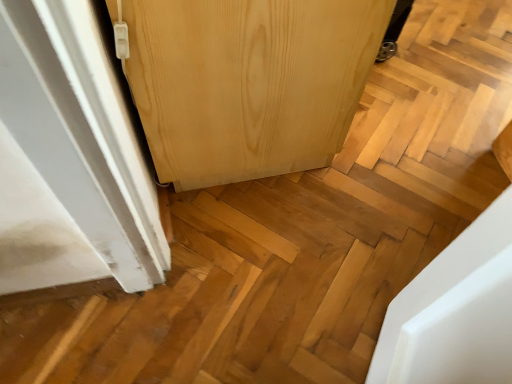
The image size is (512, 384). What are the coordinates of `natural wood door at center` in the screenshot? It's located at (248, 82).

The height and width of the screenshot is (384, 512). Describe the element at coordinates (248, 82) in the screenshot. I see `natural wood door at center` at that location.

Where is `natural wood door at center`? This screenshot has width=512, height=384. natural wood door at center is located at coordinates (248, 82).